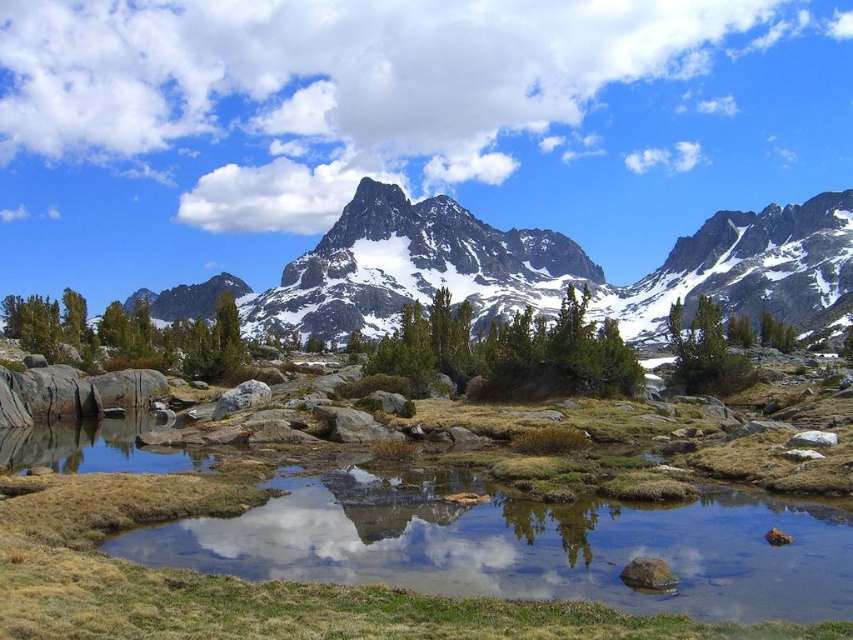
Question: Which of the following is the farthest from the observer?

Choices:
 (A) (213, 317)
 (B) (753, 276)
 (C) (738, 376)

Answer: (A)

Question: Is green matte tree at left above green matte tree at center?

Choices:
 (A) yes
 (B) no

Answer: (A)

Question: Which point is closer to the camera?

Choices:
 (A) white snow-covered mountain range at upper center
 (B) green matte tree at left

Answer: (B)

Question: Does green matte shrub at center appear over green matte tree at left?

Choices:
 (A) no
 (B) yes

Answer: (A)

Question: Can you confirm if clear water at center is smaller than white snow-covered mountain range at upper center?

Choices:
 (A) no
 (B) yes

Answer: (B)

Question: Which point is farther to the camera?

Choices:
 (A) (335, 566)
 (B) (341, 307)

Answer: (B)